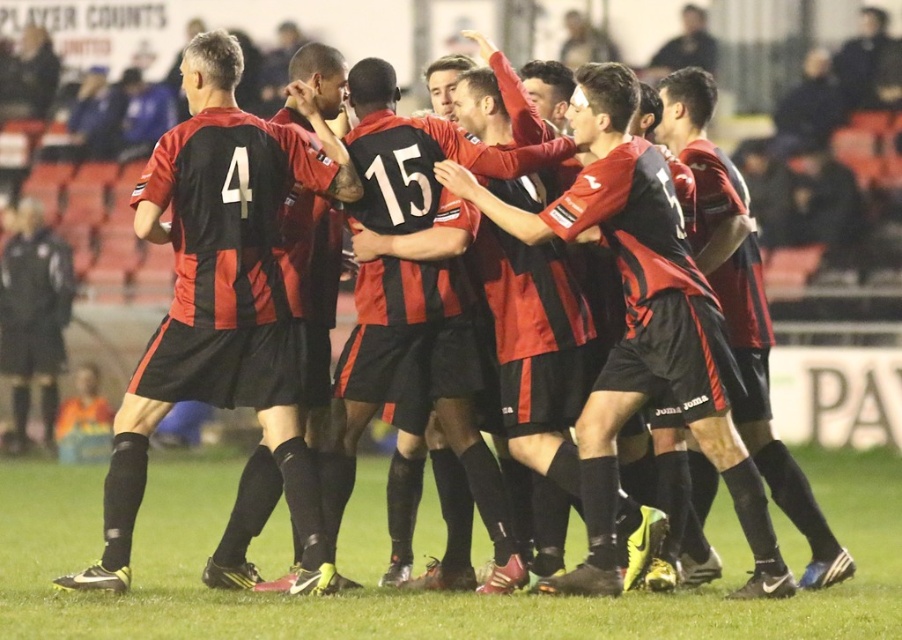
You are a photographer standing at the edge of the soccer field. You want to take a photo of the green grass at center and the matte jersey at left so that both are clearly visible. Based on their positions, which object should you focus on first to ensure both are in frame?

The green grass at center is positioned on the right side of matte jersey at left, so you should focus on the matte jersey at left first to ensure both are in frame.

You are a soccer coach observing the field. You notice the green grass at center and the matte jersey at left. Which object is taller?

The green grass at center is much taller than the matte jersey at left.